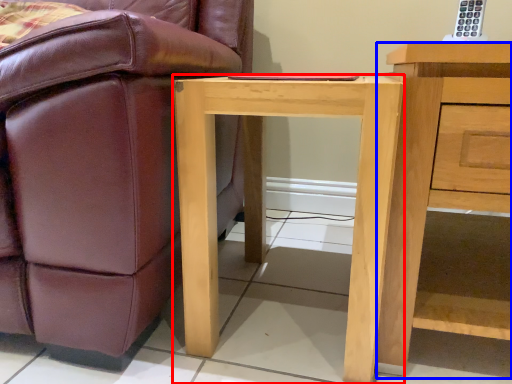
Question: Among these objects, which one is nearest to the camera, desk (highlighted by a red box) or nightstand (highlighted by a blue box)?

Choices:
 (A) desk
 (B) nightstand

Answer: (B)